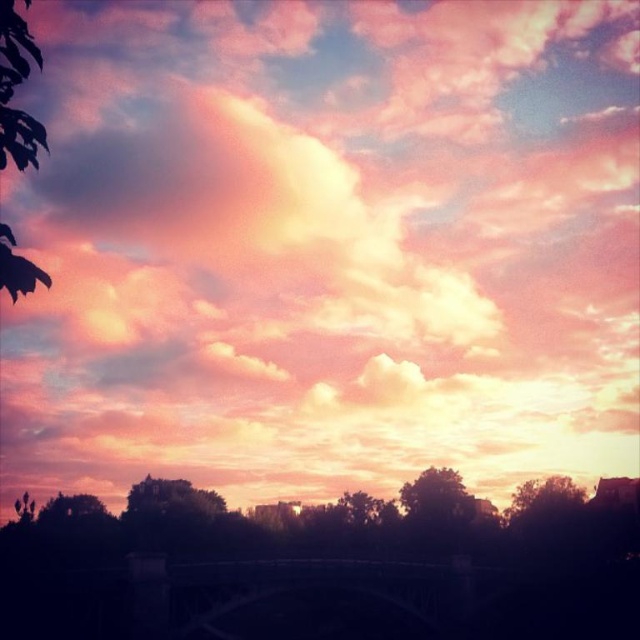
Question: Among these points, which one is nearest to the camera?

Choices:
 (A) (541, 493)
 (B) (436, 524)

Answer: (A)

Question: Which is nearer to the silhouetted tree at center?

Choices:
 (A) green leafy tree at left
 (B) silhouetted leafy tree at lower right

Answer: (B)

Question: Is green leafy tree at left wider than silhouetted tree at center?

Choices:
 (A) yes
 (B) no

Answer: (A)

Question: Is green leafy tree at left smaller than silhouetted leafy tree at lower right?

Choices:
 (A) no
 (B) yes

Answer: (A)

Question: Is silhouetted leafy tree at lower right smaller than silhouetted tree at center?

Choices:
 (A) yes
 (B) no

Answer: (B)

Question: Which point appears farthest from the camera in this image?

Choices:
 (A) (577, 496)
 (B) (465, 509)

Answer: (B)